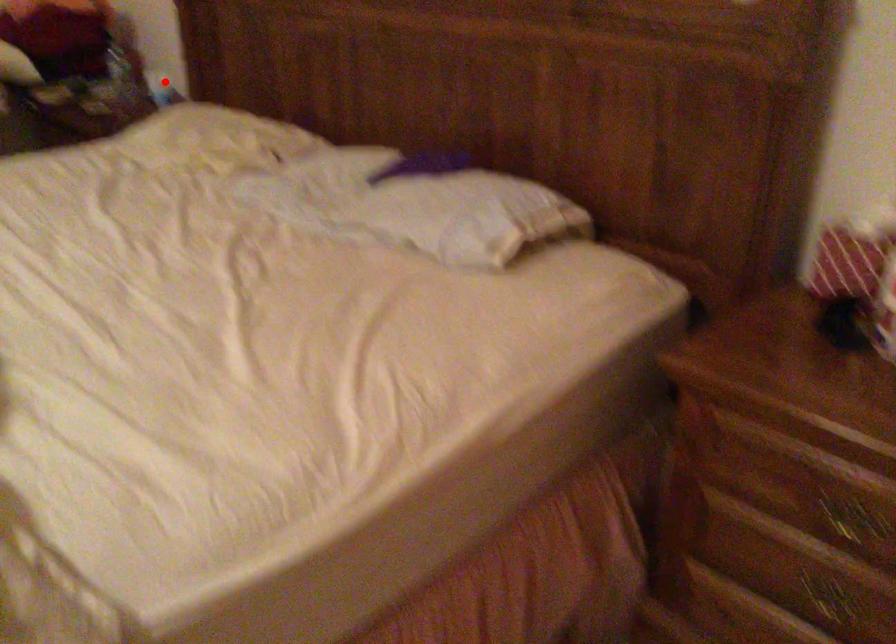
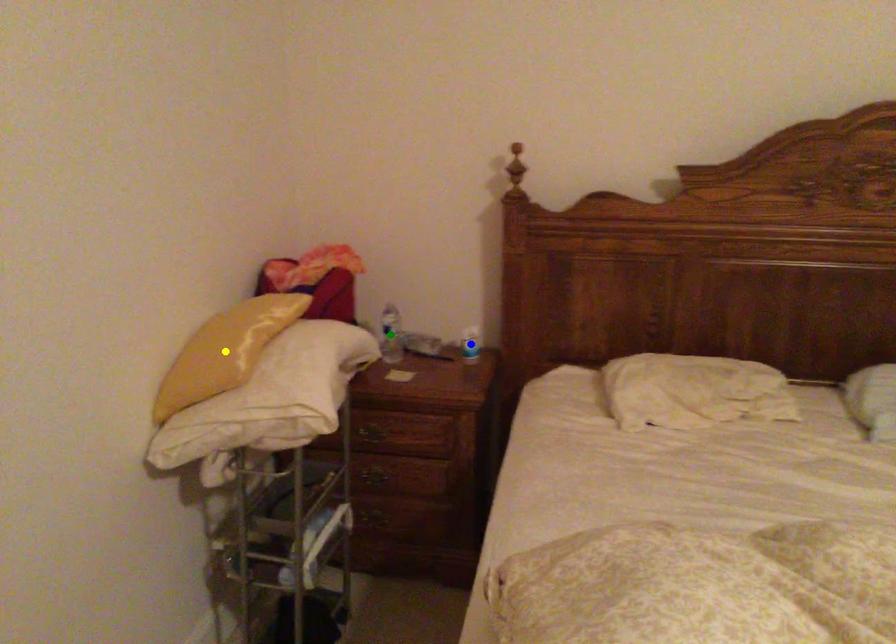
Question: I am providing you with two images of the same scene from different viewpoints. A red point is marked on the first image. You are given multiple points on the second image. Can you choose the point in image 2 that corresponds to the point in image 1?

Choices:
 (A) yellow point
 (B) blue point
 (C) green point

Answer: (B)